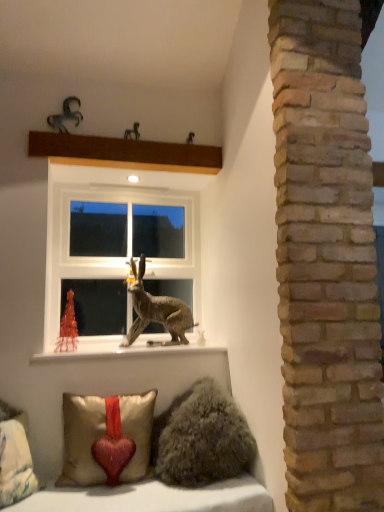
Question: Does metallic horse at upper center, which is counted as the fourth animal, starting from the front, appear on the left side of brown wooden beam at upper center?

Choices:
 (A) no
 (B) yes

Answer: (A)

Question: Can you confirm if metallic horse at upper center, placed as the 3th animal when sorted from bottom to top, is wider than brown wooden beam at upper center?

Choices:
 (A) no
 (B) yes

Answer: (A)

Question: Is metallic horse at upper center, which is counted as the second animal, starting from the top, turned away from brown wooden beam at upper center?

Choices:
 (A) no
 (B) yes

Answer: (A)

Question: From the image's perspective, is metallic horse at upper center, which is counted as the fourth animal, starting from the front, beneath brown wooden beam at upper center?

Choices:
 (A) yes
 (B) no

Answer: (B)

Question: Considering the relative sizes of metallic horse at upper center, which appears as the second animal when viewed from the left, and brown wooden beam at upper center in the image provided, is metallic horse at upper center, which appears as the second animal when viewed from the left, shorter than brown wooden beam at upper center?

Choices:
 (A) no
 (B) yes

Answer: (B)

Question: Would you say metallic horse at upper center, which is counted as the fourth animal, starting from the front, contains brown wooden beam at upper center?

Choices:
 (A) no
 (B) yes

Answer: (A)

Question: Considering the relative sizes of white plastic window at center and metallic brown rabbit at center, placed as the 2th animal when sorted from right to left, in the image provided, is white plastic window at center bigger than metallic brown rabbit at center, placed as the 2th animal when sorted from right to left,?

Choices:
 (A) yes
 (B) no

Answer: (A)

Question: From a real-world perspective, is white plastic window at center located higher than metallic brown rabbit at center, which is the 2th animal in bottom-to-top order?

Choices:
 (A) no
 (B) yes

Answer: (B)

Question: Is white plastic window at center directly adjacent to metallic brown rabbit at center, placed as the third animal when sorted from front to back?

Choices:
 (A) no
 (B) yes

Answer: (A)

Question: Is white plastic window at center thinner than metallic brown rabbit at center, marked as the 2th animal in a back-to-front arrangement?

Choices:
 (A) yes
 (B) no

Answer: (A)

Question: Is white plastic window at center wider than metallic brown rabbit at center, marked as the 2th animal in a back-to-front arrangement?

Choices:
 (A) yes
 (B) no

Answer: (B)

Question: From the image's perspective, is white plastic window at center above metallic brown rabbit at center, placed as the 3th animal when sorted from left to right?

Choices:
 (A) no
 (B) yes

Answer: (B)

Question: Is satin gold pillow with red heart at lower left, the second pillow from the left, not close to metallic horse at upper left, the fourth animal when ordered from bottom to top?

Choices:
 (A) no
 (B) yes

Answer: (B)